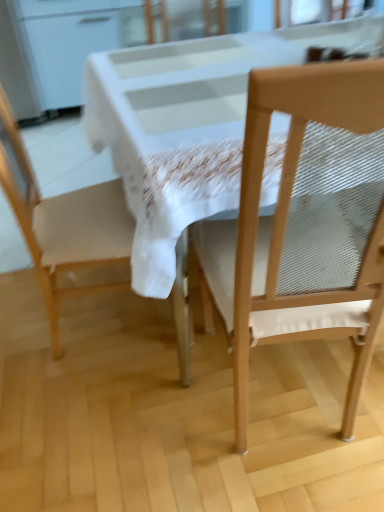
Question: Is matte white chair at left, positioned as the first chair in left-to-right order, not within wooden chair at right, acting as the 1th chair starting from the right?

Choices:
 (A) yes
 (B) no

Answer: (A)

Question: Is the position of matte white chair at left, positioned as the first chair in left-to-right order, more distant than that of wooden chair at right, marked as the second chair in a left-to-right arrangement?

Choices:
 (A) no
 (B) yes

Answer: (B)

Question: From the image's perspective, does matte white chair at left, which appears as the 2th chair when viewed from the right, appear lower than wooden chair at right, marked as the second chair in a left-to-right arrangement?

Choices:
 (A) yes
 (B) no

Answer: (B)

Question: From a real-world perspective, is matte white chair at left, positioned as the first chair in left-to-right order, located beneath wooden chair at right, acting as the 1th chair starting from the right?

Choices:
 (A) yes
 (B) no

Answer: (B)

Question: Does matte white chair at left, which appears as the 2th chair when viewed from the right, contain wooden chair at right, marked as the second chair in a left-to-right arrangement?

Choices:
 (A) yes
 (B) no

Answer: (B)

Question: Considering the relative sizes of matte white chair at left, which appears as the 2th chair when viewed from the right, and wooden chair at right, acting as the 1th chair starting from the right, in the image provided, is matte white chair at left, which appears as the 2th chair when viewed from the right, bigger than wooden chair at right, acting as the 1th chair starting from the right,?

Choices:
 (A) no
 (B) yes

Answer: (A)

Question: Does matte white chair at left, positioned as the first chair in left-to-right order, have a greater width compared to white glossy table at center?

Choices:
 (A) yes
 (B) no

Answer: (B)

Question: Does matte white chair at left, which appears as the 2th chair when viewed from the right, appear on the left side of white glossy table at center?

Choices:
 (A) no
 (B) yes

Answer: (B)

Question: Is matte white chair at left, positioned as the first chair in left-to-right order, positioned behind white glossy table at center?

Choices:
 (A) yes
 (B) no

Answer: (A)

Question: Does matte white chair at left, positioned as the first chair in left-to-right order, have a lesser height compared to white glossy table at center?

Choices:
 (A) yes
 (B) no

Answer: (B)

Question: From a real-world perspective, is matte white chair at left, positioned as the first chair in left-to-right order, physically above white glossy table at center?

Choices:
 (A) yes
 (B) no

Answer: (A)

Question: From a real-world perspective, is matte white chair at left, which appears as the 2th chair when viewed from the right, beneath white glossy table at center?

Choices:
 (A) no
 (B) yes

Answer: (A)

Question: From the image's perspective, would you say wooden chair at right, acting as the 1th chair starting from the right, is positioned over white glossy table at center?

Choices:
 (A) no
 (B) yes

Answer: (A)